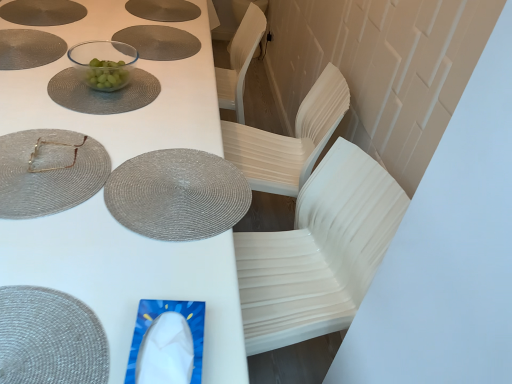
Locate an element on the screen. The image size is (512, 384). vacant space situated above transparent glass bowl at upper center, the 1th glass plate positioned from the top (from a real-world perspective) is located at coordinates (94, 84).